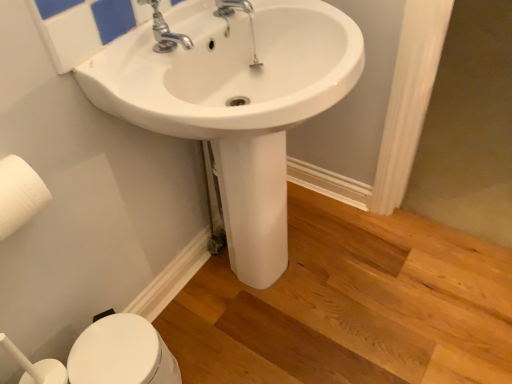
Measure the distance between polished chrome faucet at upper center and camera.

The distance of polished chrome faucet at upper center from camera is 33.71 inches.

Describe the element at coordinates (234, 102) in the screenshot. I see `white glossy sink at center` at that location.

You are a GUI agent. You are given a task and a screenshot of the screen. Output one action in this format:
    pyautogui.click(x=<x>, y=<y>)
    Task: Click on the white glossy bidet at lower left
    
    Given the screenshot: What is the action you would take?
    [121, 353]

What is the approximate width of white glossy bidet at lower left?

white glossy bidet at lower left is 9.83 inches in width.

Locate an element on the screen. The image size is (512, 384). polished chrome faucet at upper center is located at coordinates (165, 31).

From the picture: Does white matte toilet paper at left have a lesser width compared to polished chrome faucet at upper center?

Indeed, white matte toilet paper at left has a lesser width compared to polished chrome faucet at upper center.

Considering the positions of point (6, 182) and point (183, 47), is point (6, 182) closer or farther from the camera than point (183, 47)?

Point (6, 182) appears to be closer to the viewer than point (183, 47).

Is white matte toilet paper at left aimed at polished chrome faucet at upper center?

No, white matte toilet paper at left is not turned towards polished chrome faucet at upper center.

Considering the sizes of white matte toilet paper at left and polished chrome faucet at upper center in the image, is white matte toilet paper at left taller or shorter than polished chrome faucet at upper center?

In the image, white matte toilet paper at left appears to be taller than polished chrome faucet at upper center.

In the image, is white glossy sink at center on the left side or the right side of white glossy bidet at lower left?

From the image, it's evident that white glossy sink at center is to the right of white glossy bidet at lower left.

Is white glossy sink at center touching white glossy bidet at lower left?

No, white glossy sink at center is not in contact with white glossy bidet at lower left.

From the image's perspective, which is above, white glossy sink at center or white glossy bidet at lower left?

From the image's view, white glossy sink at center is above.

Who is smaller, white matte toilet paper at left or white glossy bidet at lower left?

white matte toilet paper at left is smaller.

From the picture: From a real-world perspective, is white matte toilet paper at left above or below white glossy bidet at lower left?

In terms of real-world spatial position, white matte toilet paper at left is above white glossy bidet at lower left.

Is white matte toilet paper at left completely or partially outside of white glossy bidet at lower left?

Absolutely, white matte toilet paper at left is external to white glossy bidet at lower left.

Which of these two, white matte toilet paper at left or white glossy bidet at lower left, is thinner?

Thinner between the two is white matte toilet paper at left.

How far apart are white glossy sink at center and white matte toilet paper at left?

A distance of 18.30 inches exists between white glossy sink at center and white matte toilet paper at left.

At what (x,y) coordinates should I click in order to perform the action: click on sink that appears in front of the white matte toilet paper at left. Please return your answer as a coordinate pair (x, y). The height and width of the screenshot is (384, 512). Looking at the image, I should click on (234, 102).

Can you confirm if white glossy sink at center is shorter than white matte toilet paper at left?

In fact, white glossy sink at center may be taller than white matte toilet paper at left.

Which object is closer to the camera taking this photo, white glossy sink at center or white matte toilet paper at left?

white glossy sink at center is in front.

Does white glossy sink at center have a greater height compared to polished chrome faucet at upper center?

Indeed, white glossy sink at center has a greater height compared to polished chrome faucet at upper center.

The image size is (512, 384). I want to click on sink that appears below the polished chrome faucet at upper center (from a real-world perspective), so click(x=234, y=102).

From a real-world perspective, does white glossy sink at center stand above polished chrome faucet at upper center?

Actually, white glossy sink at center is physically below polished chrome faucet at upper center in the real world.

In the scene shown: Considering the relative positions of white glossy sink at center and polished chrome faucet at upper center in the image provided, is white glossy sink at center to the left of polished chrome faucet at upper center from the viewer's perspective?

Incorrect, white glossy sink at center is not on the left side of polished chrome faucet at upper center.

Consider the image. Is the position of white glossy bidet at lower left less distant than that of white matte toilet paper at left?

No, white glossy bidet at lower left is behind white matte toilet paper at left.

Is white glossy bidet at lower left surrounding white matte toilet paper at left?

Definitely not — white matte toilet paper at left is not inside white glossy bidet at lower left.

Is white glossy bidet at lower left facing away from polished chrome faucet at upper center?

No, polished chrome faucet at upper center is not at the back of white glossy bidet at lower left.

From the image's perspective, is white glossy bidet at lower left on top of polished chrome faucet at upper center?

No, from the image's perspective, white glossy bidet at lower left is not above polished chrome faucet at upper center.

Locate an element on the screen. bidet on the left of the polished chrome faucet at upper center is located at coordinates (121, 353).

Locate an element on the screen. toilet paper below the polished chrome faucet at upper center (from a real-world perspective) is located at coordinates (19, 194).

The height and width of the screenshot is (384, 512). What are the coordinates of `sink on the right of white glossy bidet at lower left` in the screenshot? It's located at (234, 102).

In the scene shown: From the image, which object appears to be nearer to white matte toilet paper at left, polished chrome faucet at upper center or white glossy bidet at lower left?

polished chrome faucet at upper center.

Considering their positions, is white matte toilet paper at left positioned further to white glossy sink at center than white glossy bidet at lower left?

white glossy bidet at lower left lies further to white glossy sink at center than the other object.

Looking at the image, which one is located further to polished chrome faucet at upper center, white matte toilet paper at left or white glossy sink at center?

Based on the image, white matte toilet paper at left appears to be further to polished chrome faucet at upper center.

Considering their positions, is white matte toilet paper at left positioned further to polished chrome faucet at upper center than white glossy bidet at lower left?

white glossy bidet at lower left lies further to polished chrome faucet at upper center than the other object.

Which object lies further to the anchor point white matte toilet paper at left, white glossy sink at center or white glossy bidet at lower left?

Among the two, white glossy sink at center is located further to white matte toilet paper at left.

Considering their positions, is white glossy bidet at lower left positioned closer to white glossy sink at center than polished chrome faucet at upper center?

The object closer to white glossy sink at center is polished chrome faucet at upper center.

Estimate the real-world distances between objects in this image. Which object is further from white matte toilet paper at left, polished chrome faucet at upper center or white glossy sink at center?

Among the two, white glossy sink at center is located further to white matte toilet paper at left.

Considering their positions, is white glossy bidet at lower left positioned further to polished chrome faucet at upper center than white glossy sink at center?

white glossy bidet at lower left.

Where is `toilet paper between white glossy sink at center and white glossy bidet at lower left in the vertical direction`? Image resolution: width=512 pixels, height=384 pixels. toilet paper between white glossy sink at center and white glossy bidet at lower left in the vertical direction is located at coordinates (19, 194).

Where is `tap between white matte toilet paper at left and white glossy sink at center from left to right`? The image size is (512, 384). tap between white matte toilet paper at left and white glossy sink at center from left to right is located at coordinates (165, 31).

Where is `toilet paper that lies between polished chrome faucet at upper center and white glossy bidet at lower left from top to bottom`? toilet paper that lies between polished chrome faucet at upper center and white glossy bidet at lower left from top to bottom is located at coordinates (19, 194).

The height and width of the screenshot is (384, 512). In order to click on sink between polished chrome faucet at upper center and white glossy bidet at lower left vertically in this screenshot , I will do `click(234, 102)`.